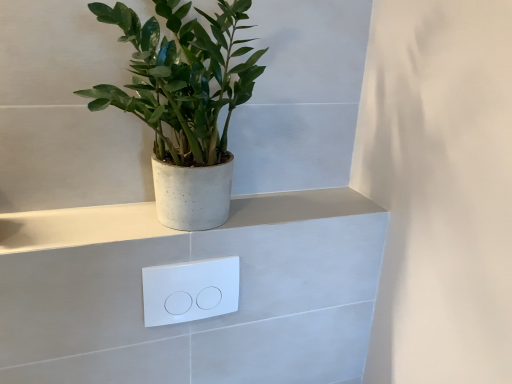
Question: From a real-world perspective, is green matte plant at upper left below white glossy/light switch at center?

Choices:
 (A) yes
 (B) no

Answer: (B)

Question: From the image's perspective, does green matte plant at upper left appear lower than white glossy/light switch at center?

Choices:
 (A) no
 (B) yes

Answer: (A)

Question: Is green matte plant at upper left oriented towards white glossy/light switch at center?

Choices:
 (A) yes
 (B) no

Answer: (B)

Question: Can you confirm if green matte plant at upper left is thinner than white glossy/light switch at center?

Choices:
 (A) no
 (B) yes

Answer: (A)

Question: Is green matte plant at upper left positioned beyond the bounds of white glossy/light switch at center?

Choices:
 (A) no
 (B) yes

Answer: (B)

Question: Is white glossy/light switch at center at the back of green matte plant at upper left?

Choices:
 (A) yes
 (B) no

Answer: (B)

Question: Is white concrete ledge at upper center smaller than white glossy/light switch at center?

Choices:
 (A) yes
 (B) no

Answer: (B)

Question: Is white concrete ledge at upper center further to camera compared to white glossy/light switch at center?

Choices:
 (A) yes
 (B) no

Answer: (B)

Question: From the image's perspective, is white concrete ledge at upper center on white glossy/light switch at center?

Choices:
 (A) yes
 (B) no

Answer: (A)

Question: From a real-world perspective, is white concrete ledge at upper center physically above white glossy/light switch at center?

Choices:
 (A) yes
 (B) no

Answer: (A)

Question: Can you confirm if white concrete ledge at upper center is shorter than white glossy/light switch at center?

Choices:
 (A) yes
 (B) no

Answer: (A)

Question: Would you say white concrete ledge at upper center is a long distance from white glossy/light switch at center?

Choices:
 (A) yes
 (B) no

Answer: (B)

Question: Is green matte plant at upper left facing towards white concrete ledge at upper center?

Choices:
 (A) yes
 (B) no

Answer: (B)